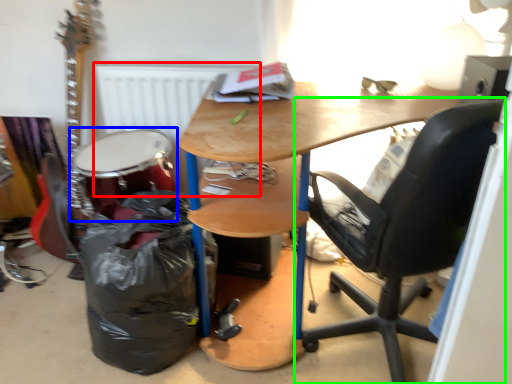
Question: Which object is positioned closest to radiator (highlighted by a red box)? Select from drum (highlighted by a blue box) and chair (highlighted by a green box).

Choices:
 (A) drum
 (B) chair

Answer: (A)